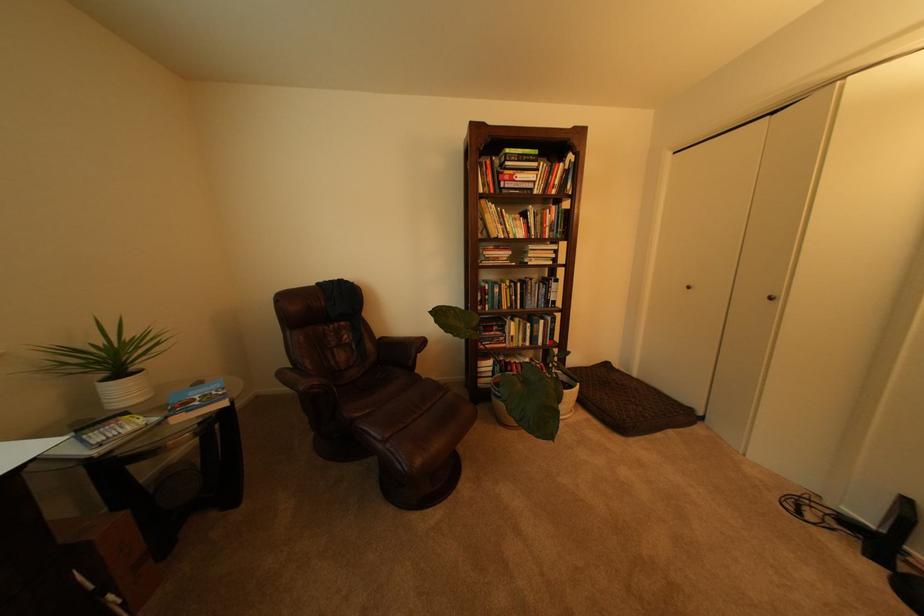
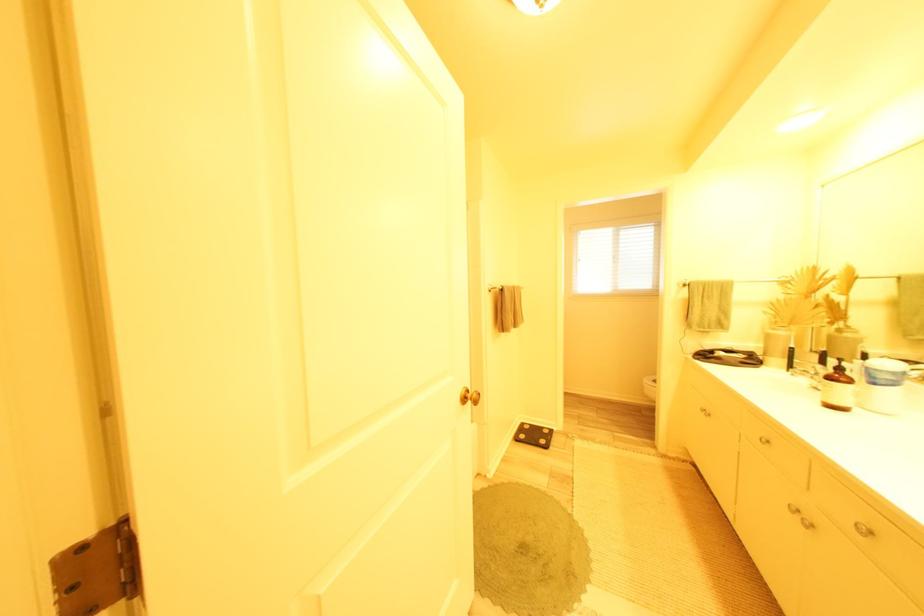
Question: I am providing you with two images of the same scene from different viewpoints. After the viewpoint changes to image2, which objects are now occluded?

Choices:
 (A) gold door knob
 (B) light blue case
 (C) brown chair armrest
 (D) green bottle pump

Answer: (C)